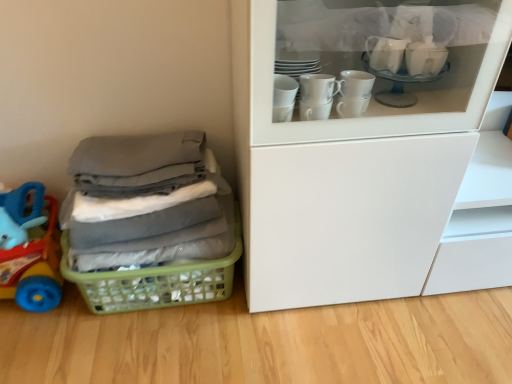
The image size is (512, 384). I want to click on gray fabric at left, so click(146, 202).

Locate an element on the screen. green plastic basket at lower left is located at coordinates (155, 282).

Does rubberized blue toy at left have a greater width compared to green plastic basket at lower left?

Incorrect, the width of rubberized blue toy at left does not surpass that of green plastic basket at lower left.

Is rubberized blue toy at left behind green plastic basket at lower left?

No, rubberized blue toy at left is closer to the viewer.

Is point (8, 239) farther from viewer compared to point (66, 237)?

That is False.

Considering the points (145, 167) and (19, 229), which point is behind, point (145, 167) or point (19, 229)?

Point (19, 229)

Are gray fabric at left and rubberized blue toy at left located far from each other?

That's not correct — gray fabric at left is a little close to rubberized blue toy at left.

Can you confirm if gray fabric at left is positioned to the left of rubberized blue toy at left?

In fact, gray fabric at left is to the right of rubberized blue toy at left.

Between gray fabric at left and rubberized blue toy at left, which one has more height?

gray fabric at left.

Is gray fabric at left oriented towards green plastic basket at lower left?

No, gray fabric at left is not oriented towards green plastic basket at lower left.

Consider the image. Is green plastic basket at lower left completely or partially inside gray fabric at left?

No, gray fabric at left does not contain green plastic basket at lower left.

Is gray fabric at left taller or shorter than green plastic basket at lower left?

Clearly, gray fabric at left is taller compared to green plastic basket at lower left.

From the picture: Who is bigger, green plastic basket at lower left or gray fabric at left?

Bigger between the two is gray fabric at left.

Based on the photo, which of these two, green plastic basket at lower left or gray fabric at left, stands taller?

gray fabric at left.

The width and height of the screenshot is (512, 384). In the image, there is a gray fabric at left. What are the coordinates of `basket below it (from a real-world perspective)` in the screenshot? It's located at tap(155, 282).

Which of these two, green plastic basket at lower left or gray fabric at left, is wider?

Wider between the two is green plastic basket at lower left.

Which is more to the left, rubberized blue toy at left or gray fabric at left?

rubberized blue toy at left.

Between rubberized blue toy at left and gray fabric at left, which one has larger width?

gray fabric at left.

Is rubberized blue toy at left turned away from gray fabric at left?

No, rubberized blue toy at left is not facing away from gray fabric at left.

Where is `toy on the left side of gray fabric at left`? Image resolution: width=512 pixels, height=384 pixels. toy on the left side of gray fabric at left is located at coordinates (29, 250).

Is the surface of green plastic basket at lower left in direct contact with rubberized blue toy at left?

There is a gap between green plastic basket at lower left and rubberized blue toy at left.

Considering the positions of objects green plastic basket at lower left and rubberized blue toy at left in the image provided, who is in front, green plastic basket at lower left or rubberized blue toy at left?

Positioned in front is rubberized blue toy at left.

From a real-world perspective, is green plastic basket at lower left physically located above or below rubberized blue toy at left?

Clearly, from a real-world perspective, green plastic basket at lower left is below rubberized blue toy at left.

Does green plastic basket at lower left have a greater width compared to rubberized blue toy at left?

Yes.

The height and width of the screenshot is (384, 512). Identify the location of basket below the rubberized blue toy at left (from a real-world perspective). click(155, 282).

Identify the location of clothing located in front of the rubberized blue toy at left. (146, 202).

Estimate the real-world distances between objects in this image. Which object is further from rubberized blue toy at left, gray fabric at left or green plastic basket at lower left?

Based on the image, gray fabric at left appears to be further to rubberized blue toy at left.

When comparing their distances from rubberized blue toy at left, does green plastic basket at lower left or gray fabric at left seem closer?

green plastic basket at lower left lies closer to rubberized blue toy at left than the other object.

In the scene shown: When comparing their distances from gray fabric at left, does green plastic basket at lower left or rubberized blue toy at left seem closer?

green plastic basket at lower left is closer to gray fabric at left.

Estimate the real-world distances between objects in this image. Which object is further from green plastic basket at lower left, rubberized blue toy at left or gray fabric at left?

Among the two, rubberized blue toy at left is located further to green plastic basket at lower left.

Looking at the image, which one is located closer to gray fabric at left, rubberized blue toy at left or green plastic basket at lower left?

green plastic basket at lower left is positioned closer to the anchor gray fabric at left.

Estimate the real-world distances between objects in this image. Which object is closer to green plastic basket at lower left, gray fabric at left or rubberized blue toy at left?

gray fabric at left.

The width and height of the screenshot is (512, 384). I want to click on basket between rubberized blue toy at left and gray fabric at left from left to right, so click(x=155, y=282).